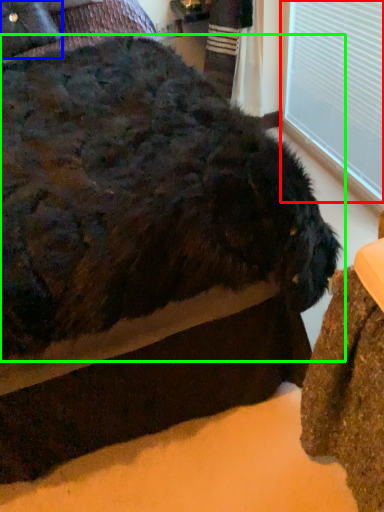
Question: Estimate the real-world distances between objects in this image. Which object is farther from window frame (highlighted by a red box), pillow (highlighted by a blue box) or dog (highlighted by a green box)?

Choices:
 (A) pillow
 (B) dog

Answer: (A)